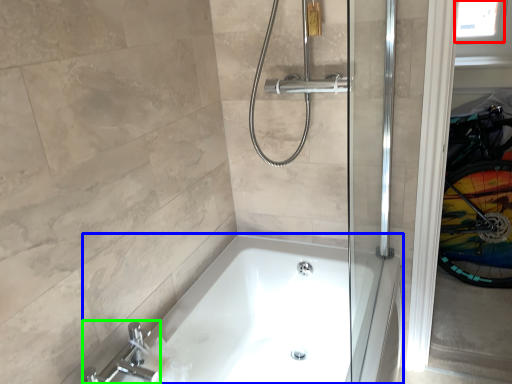
Question: Which object is positioned farthest from window screen (highlighted by a red box)? Select from bathtub (highlighted by a blue box) and tap (highlighted by a green box).

Choices:
 (A) bathtub
 (B) tap

Answer: (B)